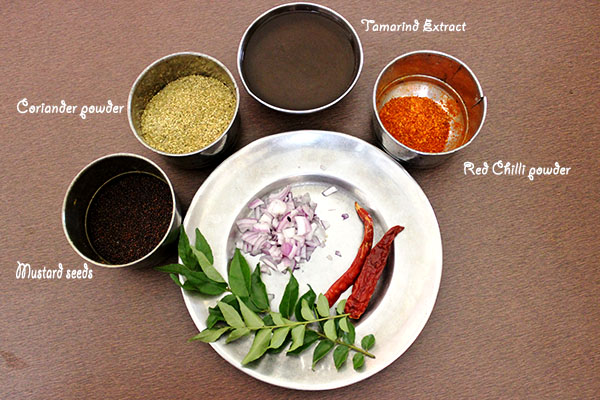
Find the location of `table`. table is located at coordinates point(577,299).